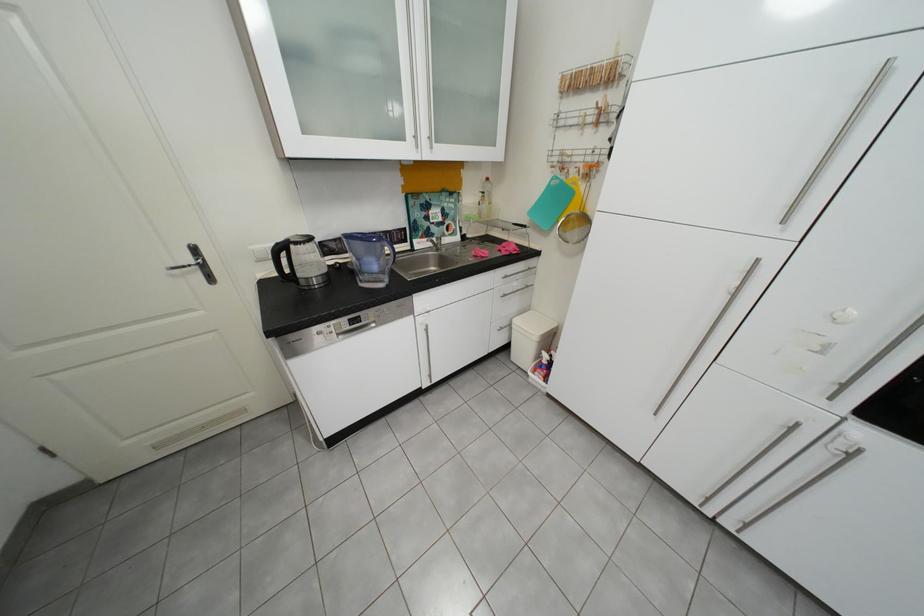
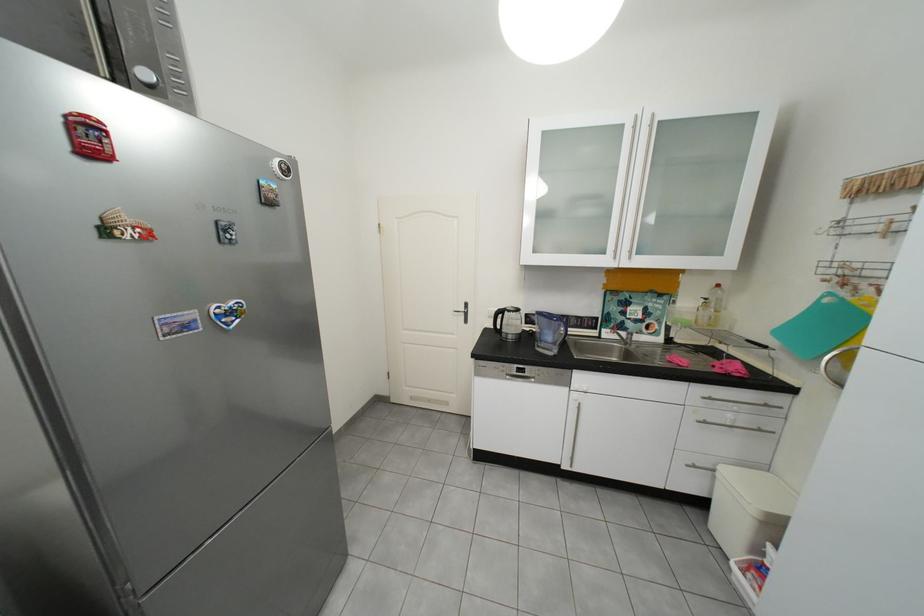
Locate, in the second image, the point that corresponds to (x=494, y=193) in the first image.

(718, 300)